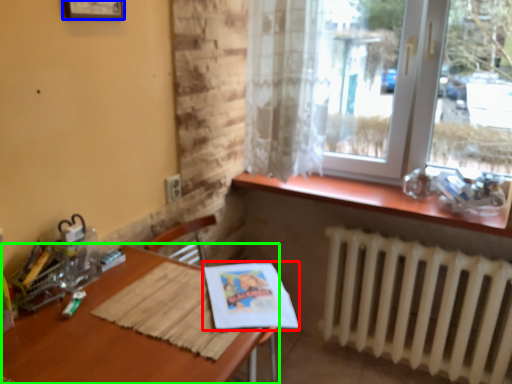
Question: Estimate the real-world distances between objects in this image. Which object is closer to magazine (highlighted by a red box), picture frame (highlighted by a blue box) or table (highlighted by a green box)?

Choices:
 (A) picture frame
 (B) table

Answer: (B)